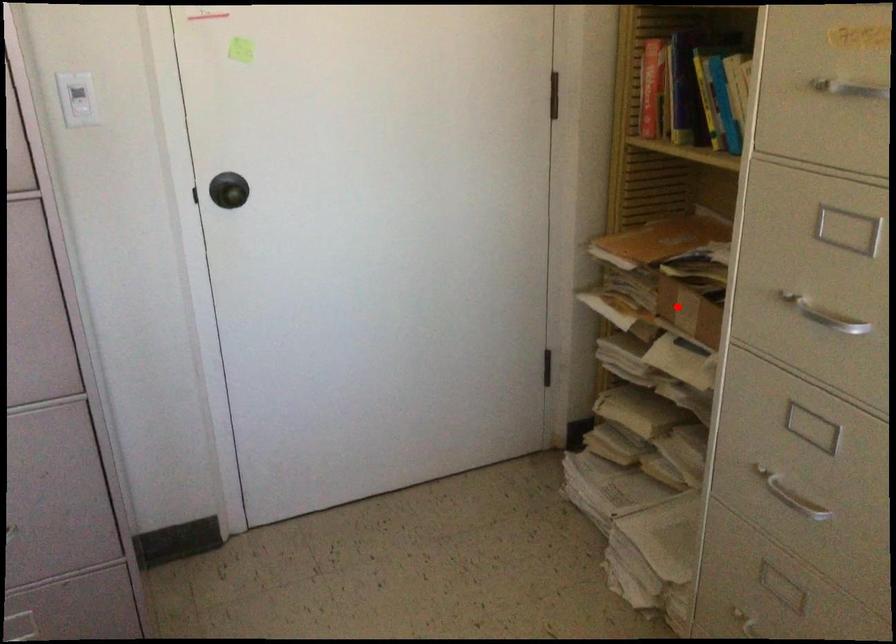
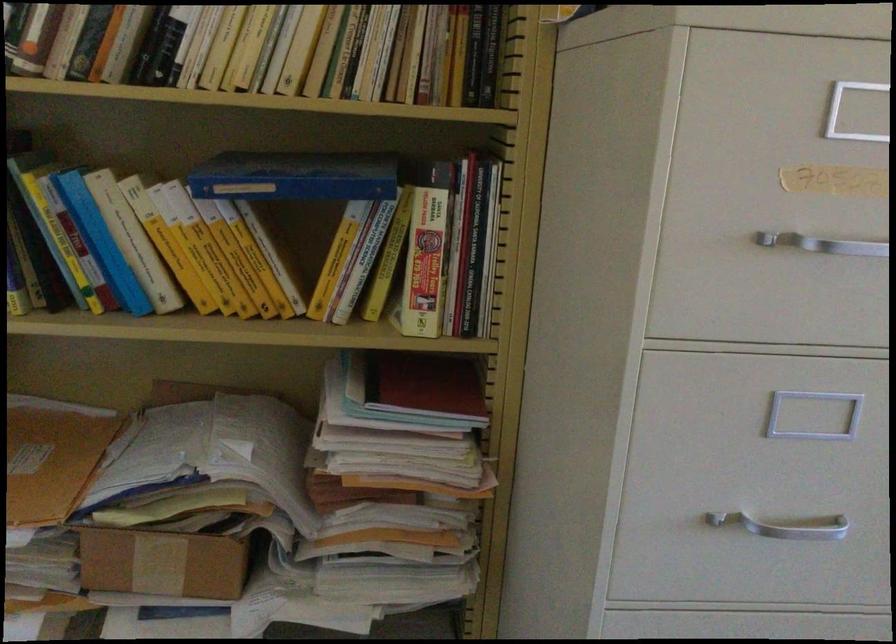
Question: I am providing you with two images of the same scene from different viewpoints. Image1 has a red point marked. In image2, the corresponding 3D location appears at what relative position? Reply with the corresponding letter.

Choices:
 (A) Closer
 (B) Farther

Answer: (A)